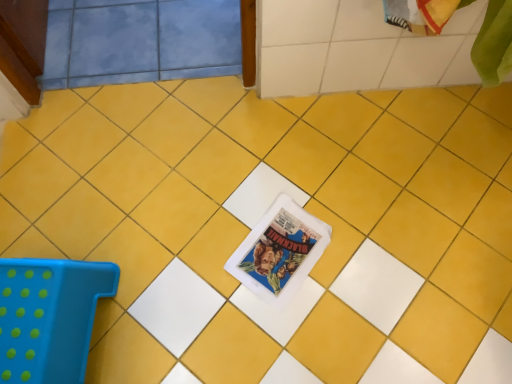
Identify the location of free spot below matte plastic comic book at center (from a real-world perspective). (283, 250).